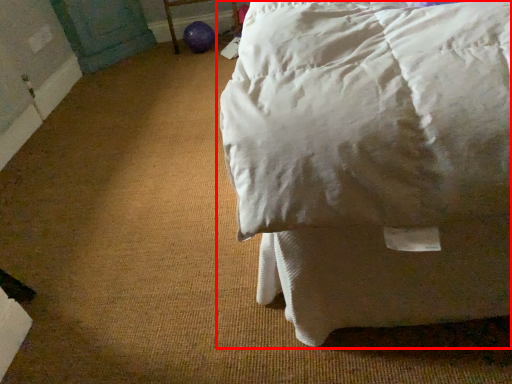
Question: Considering the relative positions of bed (annotated by the red box) and furniture in the image provided, where is bed (annotated by the red box) located with respect to the staircase?

Choices:
 (A) left
 (B) right

Answer: (B)